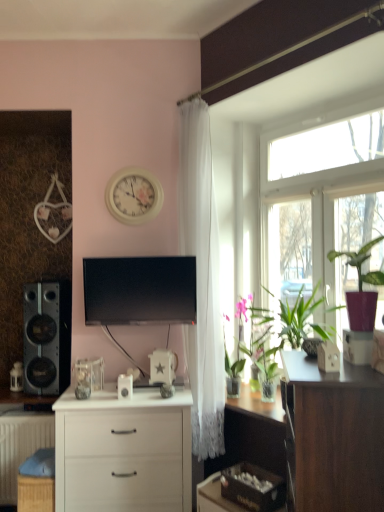
Question: Do you think white matte chest of drawers at center is within transparent glass window at upper right, or outside of it?

Choices:
 (A) inside
 (B) outside

Answer: (B)

Question: From a real-world perspective, is white matte chest of drawers at center physically located above or below transparent glass window at upper right?

Choices:
 (A) below
 (B) above

Answer: (A)

Question: Estimate the real-world distances between objects in this image. Which object is farther from the matte purple pot at right?

Choices:
 (A) white sheer curtain at upper center
 (B) white matte radiator at lower left
 (C) white glossy clock at upper center
 (D) matte black speaker at left
 (E) woven brown picnic basket at lower left

Answer: (B)

Question: Based on their relative distances, which object is nearer to the white matte chest of drawers at center?

Choices:
 (A) matte black speaker at left
 (B) matte purple pot at right
 (C) woven brown picnic basket at lower left
 (D) white matte radiator at lower left
 (E) transparent glass window at upper right

Answer: (C)